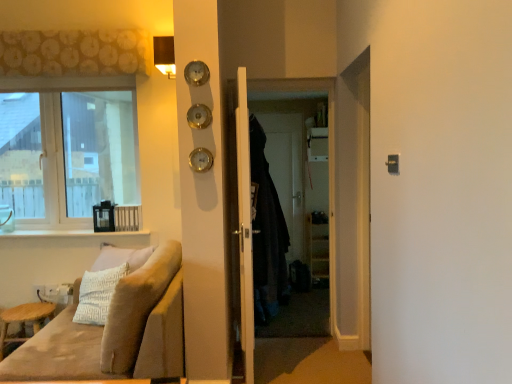
Question: Is dark fabric coat at center outside velvet beige couch at lower left?

Choices:
 (A) no
 (B) yes

Answer: (B)

Question: Is dark fabric coat at center at the right side of velvet beige couch at lower left?

Choices:
 (A) yes
 (B) no

Answer: (A)

Question: Could you tell me if dark fabric coat at center is turned towards velvet beige couch at lower left?

Choices:
 (A) yes
 (B) no

Answer: (B)

Question: Is the surface of dark fabric coat at center in direct contact with velvet beige couch at lower left?

Choices:
 (A) yes
 (B) no

Answer: (B)

Question: Can you confirm if dark fabric coat at center is thinner than velvet beige couch at lower left?

Choices:
 (A) yes
 (B) no

Answer: (A)

Question: Does dark fabric coat at center have a greater height compared to velvet beige couch at lower left?

Choices:
 (A) yes
 (B) no

Answer: (A)

Question: From the image's perspective, would you say clear glass window at upper left is positioned over white glossy window sill at lower left?

Choices:
 (A) yes
 (B) no

Answer: (A)

Question: Does clear glass window at upper left come behind white glossy window sill at lower left?

Choices:
 (A) no
 (B) yes

Answer: (B)

Question: Is clear glass window at upper left taller than white glossy window sill at lower left?

Choices:
 (A) no
 (B) yes

Answer: (B)

Question: From a real-world perspective, is clear glass window at upper left on top of white glossy window sill at lower left?

Choices:
 (A) no
 (B) yes

Answer: (B)

Question: Is clear glass window at upper left located outside white glossy window sill at lower left?

Choices:
 (A) yes
 (B) no

Answer: (A)

Question: Does clear glass window at upper left have a greater width compared to white glossy window sill at lower left?

Choices:
 (A) no
 (B) yes

Answer: (B)

Question: Could patterned fabric curtain at upper left be considered to be inside gold metallic clock at center?

Choices:
 (A) no
 (B) yes

Answer: (A)